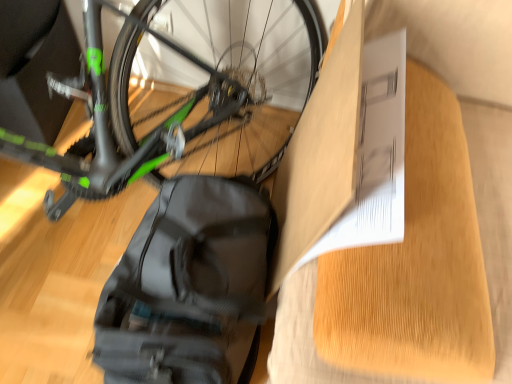
The width and height of the screenshot is (512, 384). What do you see at coordinates (341, 153) in the screenshot?
I see `matte cardboard box at center` at bounding box center [341, 153].

The image size is (512, 384). What are the coordinates of `black matte backpack at lower left` in the screenshot? It's located at (189, 287).

Who is bigger, matte cardboard box at center or white paper at upper right?

Bigger between the two is white paper at upper right.

Which is more to the right, matte cardboard box at center or white paper at upper right?

Positioned to the right is white paper at upper right.

From the image's perspective, which one is positioned higher, matte cardboard box at center or white paper at upper right?

From the image's view, matte cardboard box at center is above.

How much distance is there between matte cardboard box at center and black matte backpack at lower left?

The distance of matte cardboard box at center from black matte backpack at lower left is 8.97 inches.

Consider the image. Is matte cardboard box at center with black matte backpack at lower left?

matte cardboard box at center and black matte backpack at lower left are clearly separated.

Is matte cardboard box at center facing away from black matte backpack at lower left?

No, black matte backpack at lower left is not at the back of matte cardboard box at center.

From a real-world perspective, between white paper at upper right and black matte backpack at lower left, who is vertically higher?

In real-world perspective, white paper at upper right is above.

Is point (444, 221) positioned in front of point (177, 362)?

Yes, point (444, 221) is closer to viewer.

In terms of width, does white paper at upper right look wider or thinner when compared to black matte backpack at lower left?

white paper at upper right is wider than black matte backpack at lower left.

Are black matte backpack at lower left and matte cardboard box at center making contact?

No, black matte backpack at lower left is not with matte cardboard box at center.

At what (x,y) coordinates should I click in order to perform the action: click on backpack that appears below the matte cardboard box at center (from the image's perspective). Please return your answer as a coordinate pair (x, y). Looking at the image, I should click on (189, 287).

Does point (217, 307) lie in front of point (350, 149)?

No, (217, 307) is further to viewer.

From the image's perspective, is black matte backpack at lower left below matte cardboard box at center?

Indeed, from the image's perspective, black matte backpack at lower left is shown beneath matte cardboard box at center.

Can you see black matte backpack at lower left touching white paper at upper right?

No, black matte backpack at lower left is not touching white paper at upper right.

Measure the distance between black matte backpack at lower left and white paper at upper right.

black matte backpack at lower left and white paper at upper right are 13.61 inches apart from each other.

From a real-world perspective, is black matte backpack at lower left positioned under white paper at upper right based on gravity?

Yes, from a real-world perspective, black matte backpack at lower left is under white paper at upper right.

Is black matte backpack at lower left looking in the opposite direction of white paper at upper right?

black matte backpack at lower left does not have its back to white paper at upper right.

Is white paper at upper right further to camera compared to matte cardboard box at center?

No, it is in front of matte cardboard box at center.

Looking at this image, is white paper at upper right far away from matte cardboard box at center?

No.

Between white paper at upper right and matte cardboard box at center, which one appears on the left side from the viewer's perspective?

Positioned to the left is matte cardboard box at center.

From the image's perspective, between white paper at upper right and matte cardboard box at center, who is located below?

white paper at upper right, from the image's perspective.

Identify the location of cardboard box behind the white paper at upper right. The height and width of the screenshot is (384, 512). (341, 153).

I want to click on cardboard box in front of the black matte backpack at lower left, so click(341, 153).

Considering their positions, is matte cardboard box at center positioned further to white paper at upper right than black matte backpack at lower left?

Based on the image, black matte backpack at lower left appears to be further to white paper at upper right.

Considering their positions, is white paper at upper right positioned closer to black matte backpack at lower left than matte cardboard box at center?

matte cardboard box at center.

Looking at the image, which one is located further to matte cardboard box at center, black matte backpack at lower left or white paper at upper right?

black matte backpack at lower left is positioned further to the anchor matte cardboard box at center.

When comparing their distances from black matte backpack at lower left, does matte cardboard box at center or white paper at upper right seem closer?

matte cardboard box at center lies closer to black matte backpack at lower left than the other object.

Which object lies further to the anchor point white paper at upper right, black matte backpack at lower left or matte cardboard box at center?

black matte backpack at lower left is further to white paper at upper right.

Which object lies further to the anchor point matte cardboard box at center, white paper at upper right or black matte backpack at lower left?

black matte backpack at lower left.

Identify the location of cardboard box between black matte backpack at lower left and white paper at upper right. The height and width of the screenshot is (384, 512). pyautogui.click(x=341, y=153).